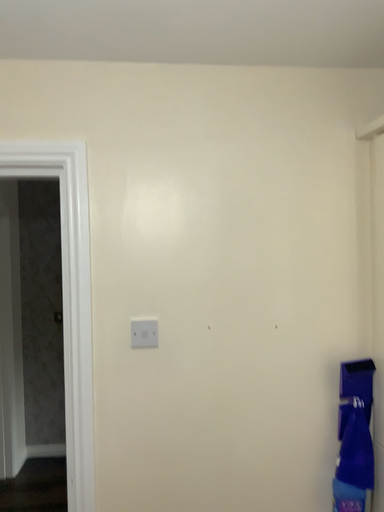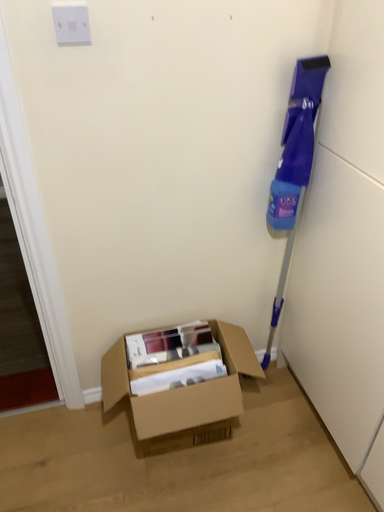
Question: How did the camera likely rotate when shooting the video?

Choices:
 (A) rotated left
 (B) rotated right

Answer: (B)